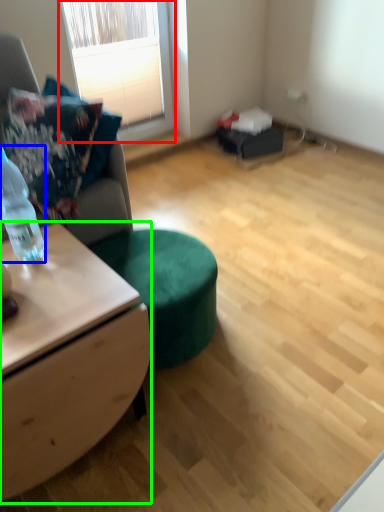
Question: Considering the real-world distances, which object is closest to window (highlighted by a red box)? bottle (highlighted by a blue box) or desk (highlighted by a green box).

Choices:
 (A) bottle
 (B) desk

Answer: (A)